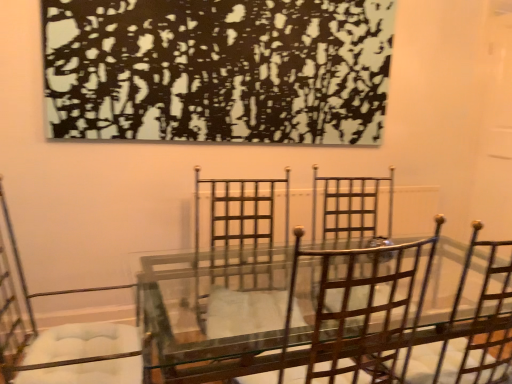
Question: From the image's perspective, is metallic silver chair at left, the 2th chair from the right, over metallic brown chair at center, the 2th chair positioned from the left?

Choices:
 (A) yes
 (B) no

Answer: (B)

Question: Is metallic silver chair at left, arranged as the first chair when viewed from the left, behind metallic brown chair at center, the 2th chair positioned from the left?

Choices:
 (A) yes
 (B) no

Answer: (A)

Question: From a real-world perspective, is metallic silver chair at left, arranged as the first chair when viewed from the left, located higher than metallic brown chair at center, the 2th chair positioned from the left?

Choices:
 (A) no
 (B) yes

Answer: (A)

Question: From the image's perspective, would you say metallic silver chair at left, the 2th chair from the right, is shown under metallic brown chair at center, which is the first chair in right-to-left order?

Choices:
 (A) no
 (B) yes

Answer: (B)

Question: Considering the relative sizes of metallic silver chair at left, arranged as the first chair when viewed from the left, and metallic brown chair at center, which is the first chair in right-to-left order, in the image provided, is metallic silver chair at left, arranged as the first chair when viewed from the left, shorter than metallic brown chair at center, which is the first chair in right-to-left order,?

Choices:
 (A) yes
 (B) no

Answer: (B)

Question: Is metallic brown chair at center, which is the first chair in right-to-left order, inside metallic silver chair at left, arranged as the first chair when viewed from the left?

Choices:
 (A) no
 (B) yes

Answer: (A)

Question: Is metallic brown chair at center, the 2th chair positioned from the left, to the left of metallic silver chair at left, arranged as the first chair when viewed from the left, from the viewer's perspective?

Choices:
 (A) yes
 (B) no

Answer: (B)

Question: Is the depth of metallic brown chair at center, which is the first chair in right-to-left order, greater than that of metallic silver chair at left, arranged as the first chair when viewed from the left?

Choices:
 (A) no
 (B) yes

Answer: (A)

Question: Is metallic brown chair at center, the 2th chair positioned from the left, outside metallic silver chair at left, arranged as the first chair when viewed from the left?

Choices:
 (A) yes
 (B) no

Answer: (A)

Question: Can you confirm if metallic brown chair at center, which is the first chair in right-to-left order, is taller than metallic silver chair at left, arranged as the first chair when viewed from the left?

Choices:
 (A) no
 (B) yes

Answer: (A)

Question: Is metallic brown chair at center, the 2th chair positioned from the left, in front of metallic silver chair at left, arranged as the first chair when viewed from the left?

Choices:
 (A) no
 (B) yes

Answer: (B)

Question: Is metallic brown chair at center, which is the first chair in right-to-left order, positioned far away from metallic silver chair at left, arranged as the first chair when viewed from the left?

Choices:
 (A) yes
 (B) no

Answer: (A)

Question: Does metallic brown chair at center, the 2th chair positioned from the left, have a greater height compared to black textured painting at upper center?

Choices:
 (A) no
 (B) yes

Answer: (A)